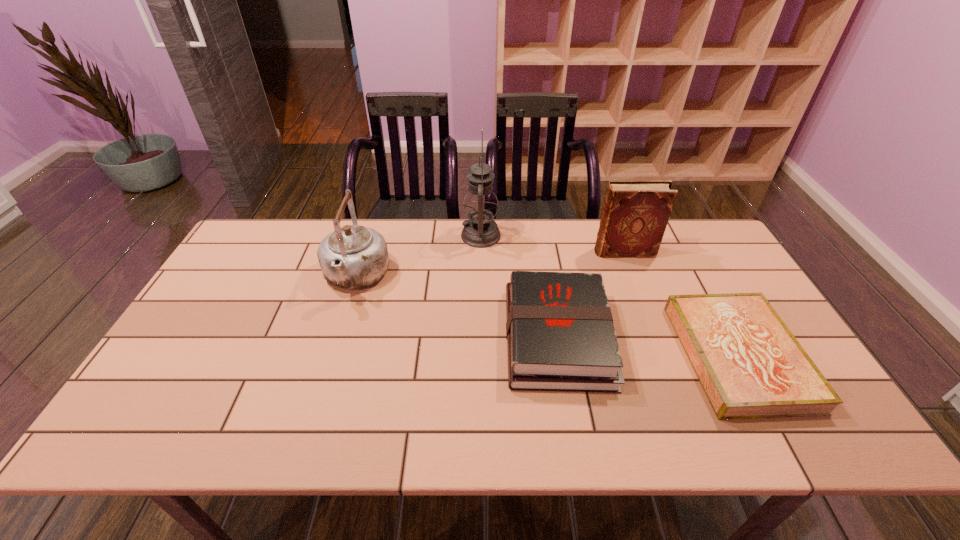
Where is `vacant region that satisfies the following two spatial constraints: 1. on the front side of the tallest object; 2. on the right side of the shortest object`? vacant region that satisfies the following two spatial constraints: 1. on the front side of the tallest object; 2. on the right side of the shortest object is located at coordinates pos(481,356).

Locate an element on the screen. This screenshot has width=960, height=540. free region that satisfies the following two spatial constraints: 1. on the front side of the shortest hardback book; 2. on the right side of the second shortest object is located at coordinates (561, 356).

You are a GUI agent. You are given a task and a screenshot of the screen. Output one action in this format:
    pyautogui.click(x=<x>, y=<y>)
    Task: Click on the free location that satisfies the following two spatial constraints: 1. on the spine side of the farthest hardback book; 2. at the spout of the leftmost object
    
    Given the screenshot: What is the action you would take?
    pyautogui.click(x=634, y=277)

This screenshot has width=960, height=540. In order to click on free space that satisfies the following two spatial constraints: 1. at the spout of the fourth tallest object; 2. on the right side of the kettle in this screenshot , I will do `click(337, 338)`.

In order to click on free location that satisfies the following two spatial constraints: 1. at the spout of the second shortest object; 2. on the left side of the leftmost object in this screenshot , I will do `click(337, 338)`.